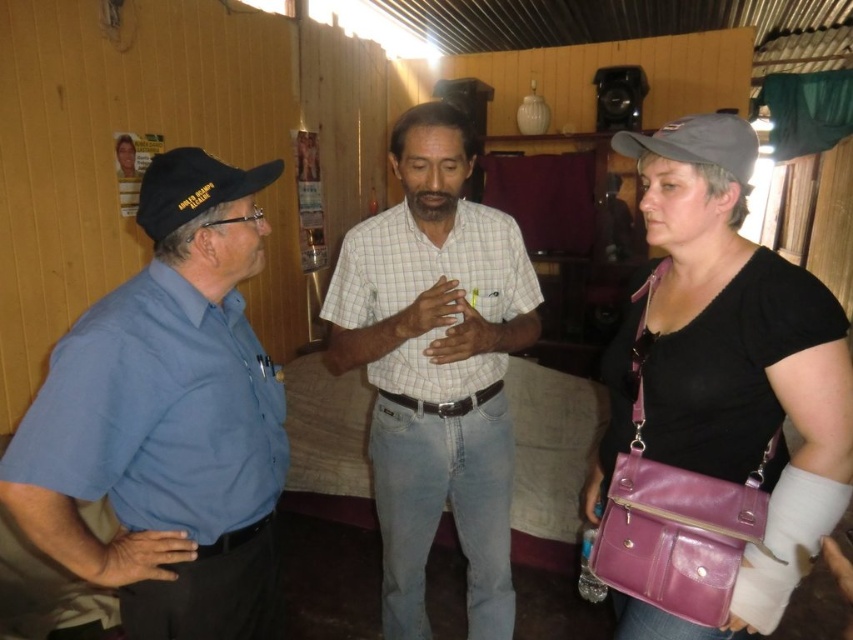
You are standing in the room and need to place a small plant between the purple leather bag at center right and the white checkered shirt at center. Where should you place the plant to ensure it is between them?

The purple leather bag at center right is positioned on the right side of the white checkered shirt at center, so placing the plant between them would require placing it to the right of the white checkered shirt at center and to the left of the purple leather bag at center right.

You are a tailor measuring hats for two customers. The first customer is wearing the black fabric baseball cap at left, and the second is wearing the gray fabric baseball cap at upper right. Which hat should you suggest needs a wider brim to ensure proper fit?

The black fabric baseball cap at left might be wider than the gray fabric baseball cap at upper right, so you should suggest the black fabric baseball cap at left needs a wider brim to ensure proper fit.

You are a photographer trying to capture a group photo of the black fabric baseball cap at left and the gray fabric baseball cap at upper right. Which cap should you focus on first if you want to include both in the frame without moving the camera?

The black fabric baseball cap at left should be focused on first since it is positioned on the left side of the gray fabric baseball cap at upper right, allowing the photographer to frame both by centering the left cap and ensuring the right cap remains within the shot.